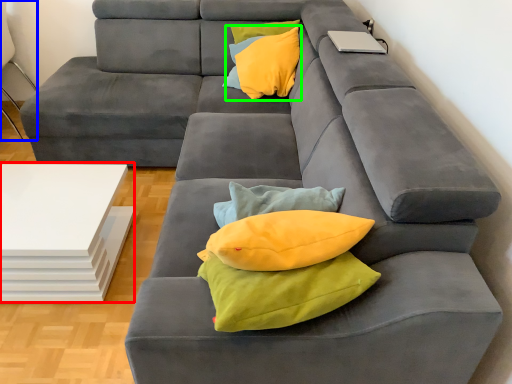
Question: Which is farther away from table (highlighted by a red box)? armchair (highlighted by a blue box) or throw pillow (highlighted by a green box)?

Choices:
 (A) armchair
 (B) throw pillow

Answer: (A)